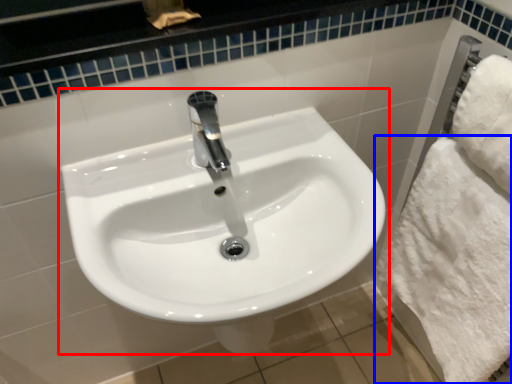
Question: Which of the following is the closest to the observer, sink (highlighted by a red box) or bath towel (highlighted by a blue box)?

Choices:
 (A) sink
 (B) bath towel

Answer: (A)